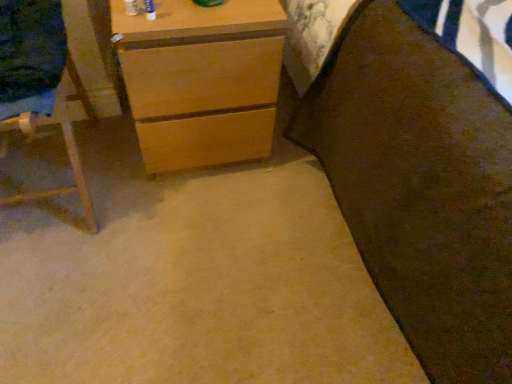
Identify the location of vacant location below wooden easel at left (from a real-world perspective). This screenshot has height=384, width=512. (49, 175).